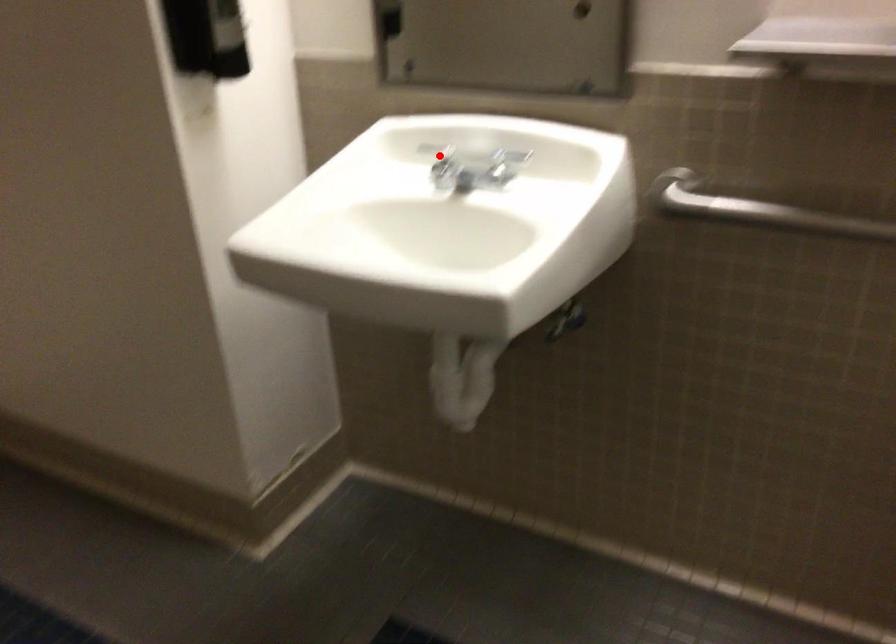
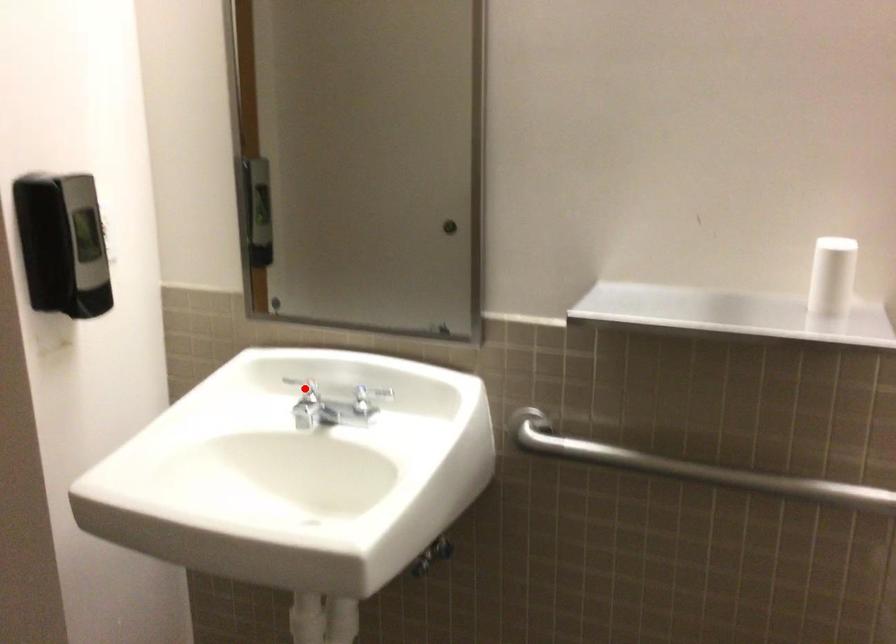
From the picture: I am providing you with two images of the same scene from different viewpoints. A red point is marked on the first image and another point is marked on the second image. Is the marked point in image1 the same physical position as the marked point in image2?

Yes